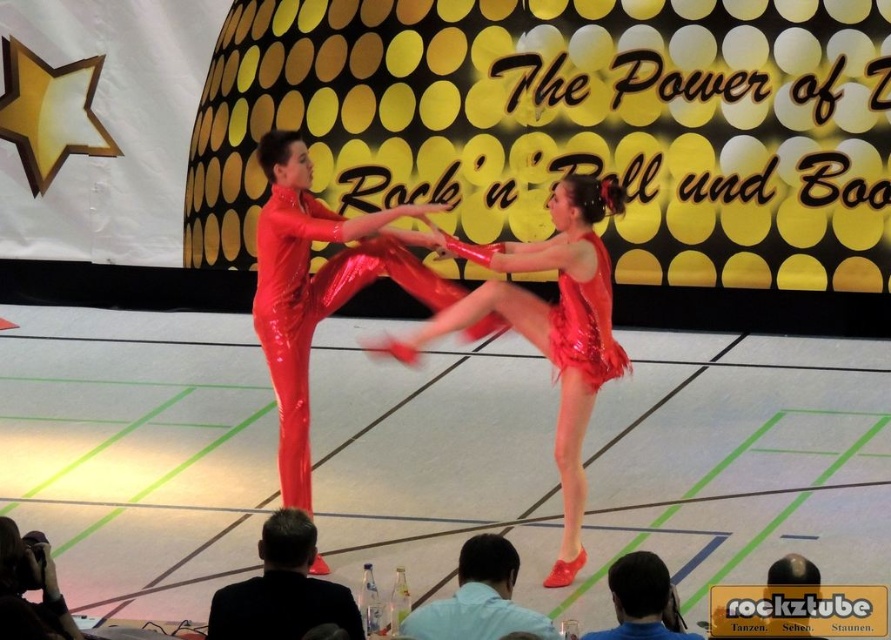
Question: Which is nearer to the silvery metallic camera at lower left?

Choices:
 (A) light blue fabric shirt at lower center
 (B) shiny red dress at center

Answer: (A)

Question: Which is nearer to the silvery metallic camera at lower left?

Choices:
 (A) light blue fabric shirt at lower center
 (B) black suit at lower center
 (C) black matte jacket at lower center

Answer: (B)

Question: Does shiny red leotard at center appear on the left side of light blue fabric shirt at lower center?

Choices:
 (A) yes
 (B) no

Answer: (A)

Question: Is shiny red leotard at center smaller than silvery metallic camera at lower left?

Choices:
 (A) yes
 (B) no

Answer: (B)

Question: Which point is farther to the camera?

Choices:
 (A) (64, 618)
 (B) (227, 637)
 (C) (642, 588)

Answer: (A)

Question: Does shiny red leotard at center have a larger size compared to black suit at lower center?

Choices:
 (A) no
 (B) yes

Answer: (B)